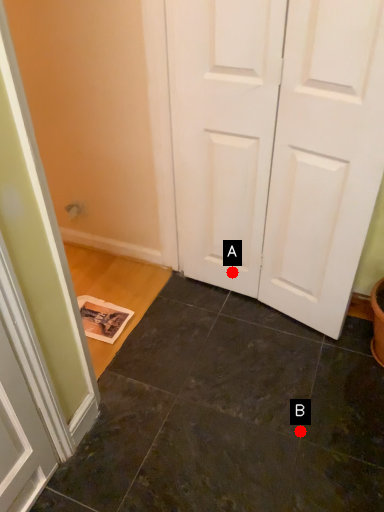
Question: Two points are circled on the image, labeled by A and B beside each circle. Which point appears farthest from the camera in this image?

Choices:
 (A) A is further
 (B) B is further

Answer: (A)